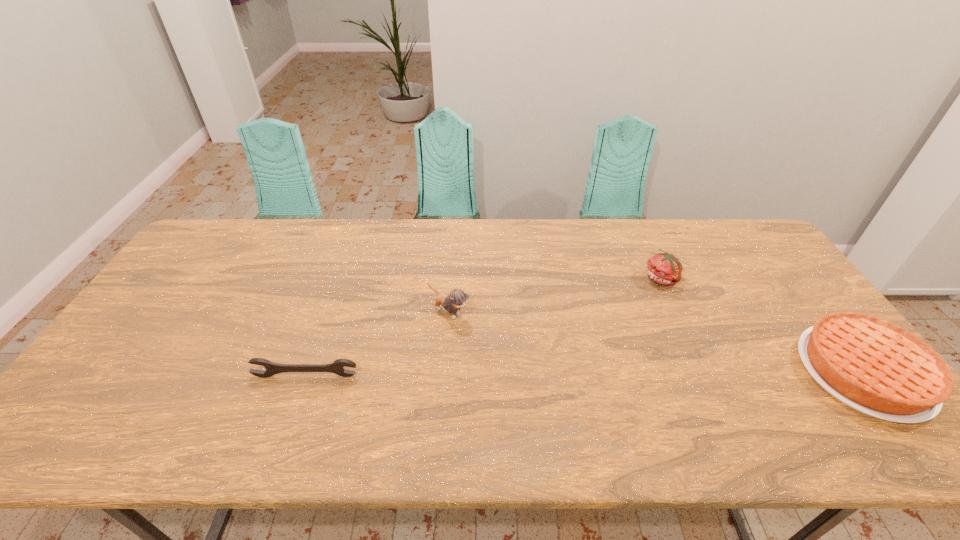
In order to click on wrench in this screenshot , I will do `click(336, 367)`.

You are a GUI agent. You are given a task and a screenshot of the screen. Output one action in this format:
    pyautogui.click(x=<x>, y=<y>)
    Task: Click on the farthest object
    
    Given the screenshot: What is the action you would take?
    pyautogui.click(x=663, y=268)

At what (x,y) coordinates should I click in order to perform the action: click on the third object from left to right. Please return your answer as a coordinate pair (x, y). Looking at the image, I should click on (663, 268).

Image resolution: width=960 pixels, height=540 pixels. Identify the location of the second object from left to right. (456, 300).

Locate an element on the screen. Image resolution: width=960 pixels, height=540 pixels. the tallest object is located at coordinates (456, 300).

Identify the location of blank area located 0.310m on the front-facing side of the tomato. (630, 362).

Find the location of `vacant region located 0.160m on the front-facing side of the tomato`. vacant region located 0.160m on the front-facing side of the tomato is located at coordinates (645, 324).

Find the location of a particular element. The width and height of the screenshot is (960, 540). free spot located on the front-facing side of the tomato is located at coordinates (647, 320).

Find the location of `free spot located on the front-facing side of the kitten`. free spot located on the front-facing side of the kitten is located at coordinates click(x=544, y=379).

In order to click on vacant space located on the front-facing side of the kitten in this screenshot , I will do `click(516, 359)`.